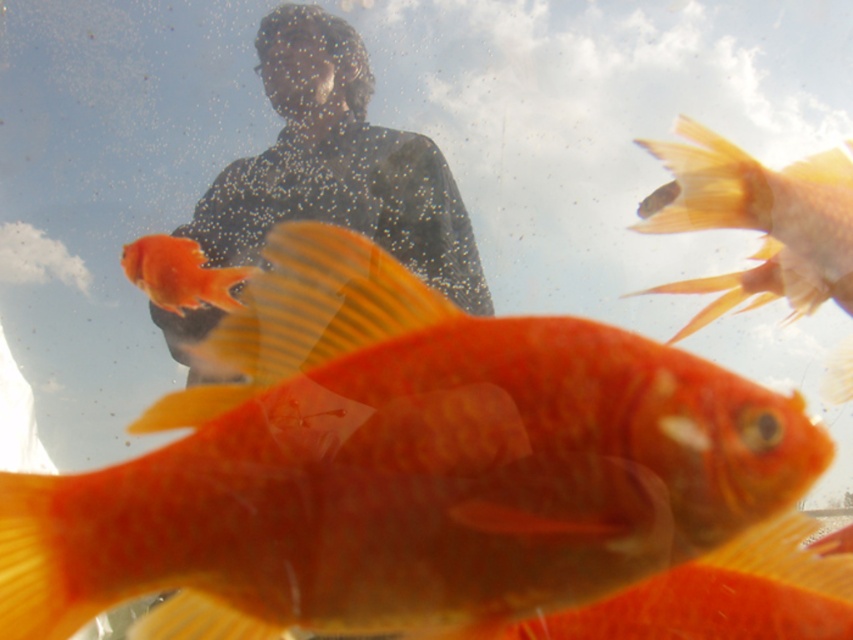
You are a diver underwater and want to take a photo of the matte orange goldfish at center without the matte black shirt at upper center appearing in the frame. Based on their distance, can you determine if it is possible to capture the goldfish without the shirt being visible?

The matte black shirt at upper center and matte orange goldfish at center are 6.54 inches apart. Since the distance between them is significant, you can adjust your camera angle or position to frame the matte orange goldfish at center without including the matte black shirt at upper center in the shot.

You are an underwater photographer trying to capture a clear shot of the orange matte goldfish at center and the matte orange goldfish at center. Which one is positioned to the right side of the other?

The orange matte goldfish at center is positioned to the right of the matte orange goldfish at center.